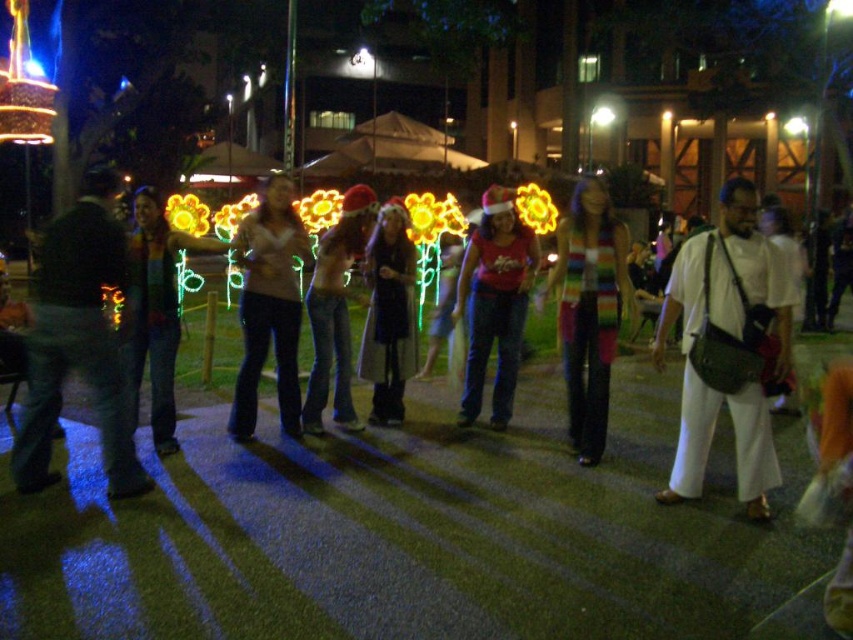
Who is shorter, rainbow striped scarf at center or jeans at center?

With less height is jeans at center.

Between rainbow striped scarf at center and jeans at center, which one has more height?

rainbow striped scarf at center is taller.

Which is behind, point (625, 301) or point (321, 412)?

Positioned behind is point (321, 412).

Where is `rainbow striped scarf at center`? This screenshot has width=853, height=640. rainbow striped scarf at center is located at coordinates (589, 310).

Which of these two, jeans at center or neon green fabric at center, stands shorter?

neon green fabric at center is shorter.

Is jeans at center below neon green fabric at center?

Yes.

Who is more forward, (340, 419) or (430, 346)?

Point (340, 419)

I want to click on jeans at center, so click(335, 310).

Image resolution: width=853 pixels, height=640 pixels. In order to click on white cotton shirt at center in this screenshot , I will do `click(729, 348)`.

Who is shorter, white cotton shirt at center or jeans at center?

white cotton shirt at center

Is point (688, 275) farther from camera compared to point (363, 218)?

No.

You are a GUI agent. You are given a task and a screenshot of the screen. Output one action in this format:
    pyautogui.click(x=<x>, y=<y>)
    Task: Click on the white cotton shirt at center
    This screenshot has width=853, height=640.
    Given the screenshot: What is the action you would take?
    pyautogui.click(x=729, y=348)